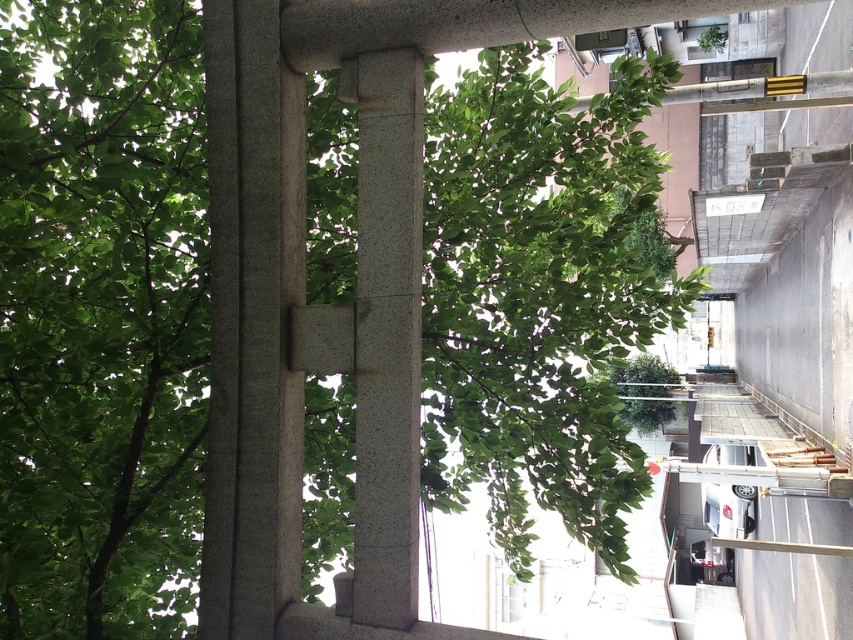
You are standing in front of a traditional Japanese torii gate made of stone pillars. You notice two pillars labeled as the slate gray stone pillar at center and the smooth gray stone pillar at center. Which pillar is positioned to the left when facing the gate?

The slate gray stone pillar at center is positioned to the left of the smooth gray stone pillar at center when facing the gate.

You are standing in front of a stone torii gate. You notice two pillars at the center. Which pillar is taller, the slate gray stone pillar at center or the smooth gray stone pillar at center?

The slate gray stone pillar at center is much taller than the smooth gray stone pillar at center.